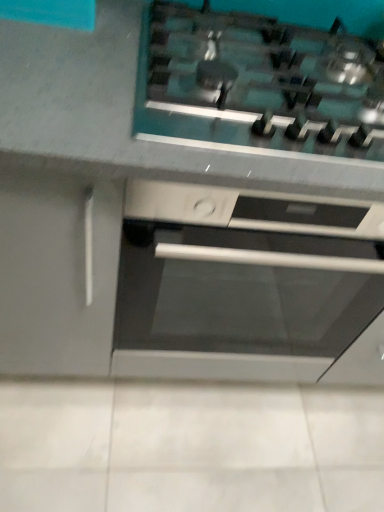
The image size is (384, 512). Describe the element at coordinates (257, 85) in the screenshot. I see `satin steel gas stove at upper center` at that location.

At what (x,y) coordinates should I click in order to perform the action: click on satin steel gas stove at upper center. Please return your answer as a coordinate pair (x, y). The image size is (384, 512). Looking at the image, I should click on (257, 85).

What is the approximate width of satin steel gas stove at upper center?

It is 54.86 centimeters.

What is the approximate height of satin steel gas stove at upper center?

satin steel gas stove at upper center is 3.43 inches tall.

Describe the element at coordinates (245, 288) in the screenshot. The height and width of the screenshot is (512, 384). I see `satin silver oven at center` at that location.

The width and height of the screenshot is (384, 512). Identify the location of satin silver oven at center. (245, 288).

Locate an element on the screen. satin steel gas stove at upper center is located at coordinates (257, 85).

Visually, is satin silver oven at center positioned to the left or to the right of satin steel gas stove at upper center?

Based on their positions, satin silver oven at center is located to the left of satin steel gas stove at upper center.

Looking at this image, which object is more forward, satin silver oven at center or satin steel gas stove at upper center?

Positioned in front is satin steel gas stove at upper center.

Which is in front, point (172, 267) or point (228, 35)?

The point (172, 267) is closer.

From the image's perspective, is satin silver oven at center located above or below satin steel gas stove at upper center?

Clearly, from the image's perspective, satin silver oven at center is below satin steel gas stove at upper center.

From a real-world perspective, which is physically below, satin silver oven at center or satin steel gas stove at upper center?

satin silver oven at center, from a real-world perspective.

Considering the sizes of objects satin silver oven at center and satin steel gas stove at upper center in the image provided, who is thinner, satin silver oven at center or satin steel gas stove at upper center?

satin steel gas stove at upper center.

Which of these two, satin silver oven at center or satin steel gas stove at upper center, stands shorter?

Standing shorter between the two is satin steel gas stove at upper center.

Is satin silver oven at center bigger than satin steel gas stove at upper center?

Yes, satin silver oven at center is bigger than satin steel gas stove at upper center.

Is satin silver oven at center situated inside satin steel gas stove at upper center or outside?

satin silver oven at center is not enclosed by satin steel gas stove at upper center.

Would you consider satin silver oven at center to be distant from satin steel gas stove at upper center?

Actually, satin silver oven at center and satin steel gas stove at upper center are a little close together.

Could you tell me if satin silver oven at center is facing satin steel gas stove at upper center?

No.

How many degrees apart are the facing directions of satin silver oven at center and satin steel gas stove at upper center?

They differ by 0.000232 degrees in their facing directions.

Locate an element on the screen. Image resolution: width=384 pixels, height=512 pixels. home appliance below the satin steel gas stove at upper center (from a real-world perspective) is located at coordinates (245, 288).

Which is more to the right, satin steel gas stove at upper center or satin silver oven at center?

satin steel gas stove at upper center is more to the right.

In the image, is satin steel gas stove at upper center positioned in front of or behind satin silver oven at center?

satin steel gas stove at upper center is in front of satin silver oven at center.

Considering the positions of points (182, 24) and (230, 201), is point (182, 24) closer to camera compared to point (230, 201)?

No, it is not.

From the image's perspective, would you say satin steel gas stove at upper center is shown under satin silver oven at center?

Actually, satin steel gas stove at upper center appears above satin silver oven at center in the image.

From the picture: From a real-world perspective, is satin steel gas stove at upper center positioned above or below satin silver oven at center?

From a real-world perspective, satin steel gas stove at upper center is physically above satin silver oven at center.

Can you confirm if satin steel gas stove at upper center is thinner than satin silver oven at center?

Yes, satin steel gas stove at upper center is thinner than satin silver oven at center.

Can you confirm if satin steel gas stove at upper center is taller than satin silver oven at center?

No.

Based on their sizes in the image, would you say satin steel gas stove at upper center is bigger or smaller than satin silver oven at center?

Clearly, satin steel gas stove at upper center is smaller in size than satin silver oven at center.

Is satin steel gas stove at upper center completely or partially outside of satin silver oven at center?

Yes.

Is satin steel gas stove at upper center not near satin silver oven at center?

Actually, satin steel gas stove at upper center and satin silver oven at center are a little close together.

Is satin steel gas stove at upper center aimed at satin silver oven at center?

No.

What's the angular difference between satin steel gas stove at upper center and satin silver oven at center's facing directions?

There is a 0.000232-degree angle between the facing directions of satin steel gas stove at upper center and satin silver oven at center.

How distant is satin steel gas stove at upper center from satin silver oven at center?

satin steel gas stove at upper center is 13.34 inches away from satin silver oven at center.

Identify the location of gas stove above the satin silver oven at center (from a real-world perspective). (257, 85).

At what (x,y) coordinates should I click in order to perform the action: click on home appliance on the left side of satin steel gas stove at upper center. Please return your answer as a coordinate pair (x, y). The image size is (384, 512). Looking at the image, I should click on (245, 288).

Find the location of `home appliance below the satin steel gas stove at upper center (from a real-world perspective)`. home appliance below the satin steel gas stove at upper center (from a real-world perspective) is located at coordinates (245, 288).